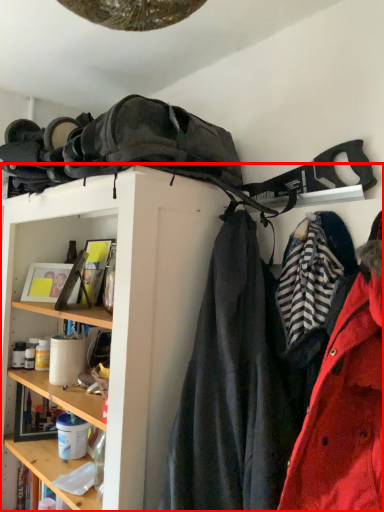
Question: From the image's perspective, where is shelf (annotated by the red box) located relative to coat?

Choices:
 (A) above
 (B) below

Answer: (B)